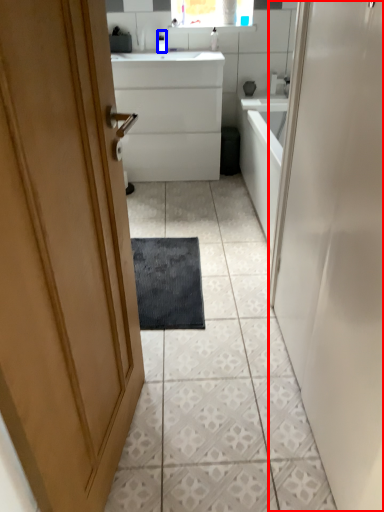
Question: Which object appears farthest to the camera in this image, door (highlighted by a red box) or toiletry (highlighted by a blue box)?

Choices:
 (A) door
 (B) toiletry

Answer: (B)